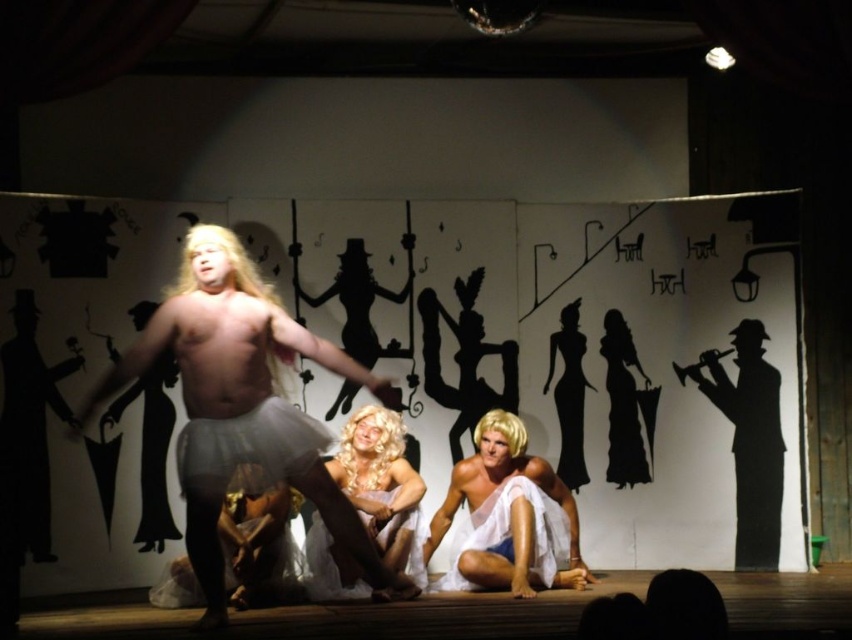
Who is higher up, white sheer skirt at center or white sheer fabric at center?

white sheer skirt at center is higher up.

Is white sheer skirt at center to the left of white sheer fabric at center from the viewer's perspective?

Correct, you'll find white sheer skirt at center to the left of white sheer fabric at center.

Does point (243, 456) come in front of point (544, 563)?

Yes, point (243, 456) is in front of point (544, 563).

This screenshot has width=852, height=640. What are the coordinates of `white sheer skirt at center` in the screenshot? It's located at (243, 406).

Does black paper trumpet at right have a greater width compared to white sheer fabric at center?

No.

Which is more to the right, black paper trumpet at right or white sheer fabric at center?

From the viewer's perspective, black paper trumpet at right appears more on the right side.

Who is more distant from viewer, (734, 435) or (548, 512)?

Point (734, 435)

In order to click on black paper trumpet at right in this screenshot , I will do `click(749, 440)`.

Is blonde wig at center shorter than white sheer fabric at center?

No.

The width and height of the screenshot is (852, 640). What do you see at coordinates (381, 484) in the screenshot?
I see `blonde wig at center` at bounding box center [381, 484].

Consider the image. Measure the distance between point (396, 525) and camera.

Point (396, 525) and camera are 6.04 meters apart.

Where is `blonde wig at center`? The width and height of the screenshot is (852, 640). blonde wig at center is located at coordinates click(x=381, y=484).